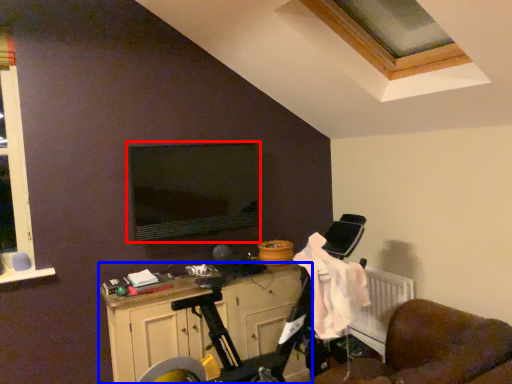
Question: Among these objects, which one is farthest to the camera, computer monitor (highlighted by a red box) or cabinetry (highlighted by a blue box)?

Choices:
 (A) computer monitor
 (B) cabinetry

Answer: (A)